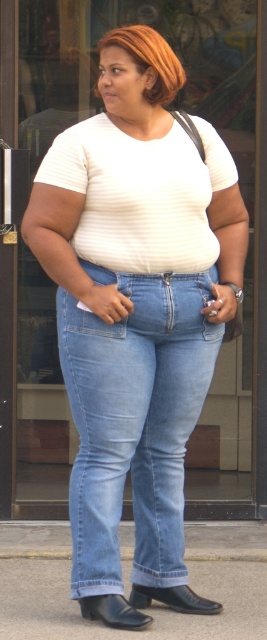
Can you confirm if light blue denim jeans at center is positioned to the right of shiny orange hair at center?

In fact, light blue denim jeans at center is to the left of shiny orange hair at center.

This screenshot has height=640, width=267. I want to click on light blue denim jeans at center, so click(x=134, y=420).

Looking at this image, measure the distance between light blue denim jeans at center and camera.

A distance of 4.23 meters exists between light blue denim jeans at center and camera.

Identify the location of light blue denim jeans at center. This screenshot has width=267, height=640. (134, 420).

Who is more forward, (140, 314) or (96, 145)?

Positioned in front is point (96, 145).

Who is positioned more to the right, light blue denim jeans at center or white striped shirt at center?

white striped shirt at center is more to the right.

Who is more forward, (131, 296) or (144, 236)?

Positioned in front is point (144, 236).

Locate an element on the screen. light blue denim jeans at center is located at coordinates (134, 420).

Between white striped shirt at center and shiny orange hair at center, which one appears on the left side from the viewer's perspective?

white striped shirt at center

Does white striped shirt at center have a greater width compared to shiny orange hair at center?

Correct, the width of white striped shirt at center exceeds that of shiny orange hair at center.

Image resolution: width=267 pixels, height=640 pixels. I want to click on white striped shirt at center, so click(x=140, y=195).